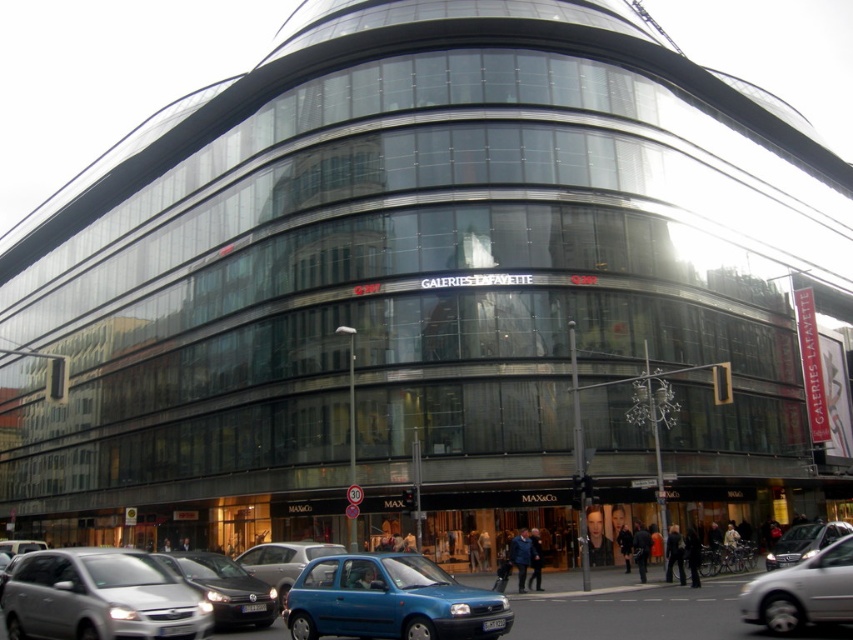
Who is more distant from viewer, (113, 586) or (311, 588)?

The point (311, 588) is behind.

Does silver metallic car at lower left have a lesser height compared to matte blue hatchback at lower center?

No.

Does point (73, 618) come closer to viewer compared to point (296, 637)?

That is True.

What are the coordinates of `silver metallic car at lower left` in the screenshot? It's located at (100, 596).

Who is positioned more to the left, silver metallic car at lower left or shiny black sedan at lower left?

silver metallic car at lower left is more to the left.

Looking at this image, is silver metallic car at lower left below shiny black sedan at lower left?

Yes.

Between point (70, 625) and point (254, 600), which one is positioned behind?

Point (254, 600)

Locate an element on the screen. This screenshot has width=853, height=640. silver metallic car at lower left is located at coordinates (100, 596).

What do you see at coordinates (390, 600) in the screenshot? The height and width of the screenshot is (640, 853). I see `matte blue hatchback at lower center` at bounding box center [390, 600].

Between matte blue hatchback at lower center and shiny black sedan at lower left, which one appears on the right side from the viewer's perspective?

From the viewer's perspective, matte blue hatchback at lower center appears more on the right side.

Which is in front, point (424, 608) or point (166, 561)?

Point (424, 608) is in front.

Identify the location of matte blue hatchback at lower center. This screenshot has width=853, height=640. (390, 600).